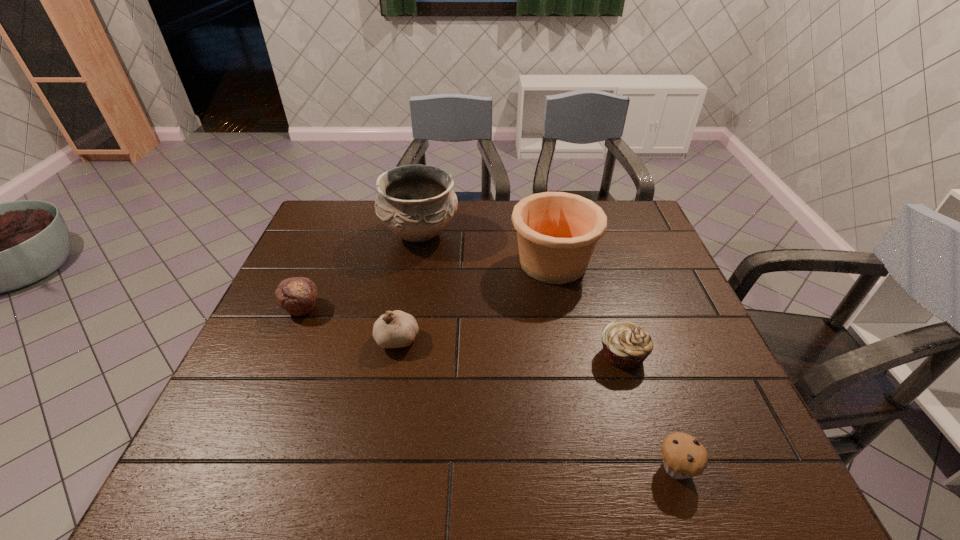
Locate an element on the screen. This screenshot has height=540, width=960. free point at the left edge is located at coordinates (297, 268).

Locate an element on the screen. The width and height of the screenshot is (960, 540). free location at the right edge of the desktop is located at coordinates point(614,244).

Where is `free space at the far right corner`? Image resolution: width=960 pixels, height=540 pixels. free space at the far right corner is located at coordinates (640, 218).

I want to click on free space between the leftmost muffin and the second nearest muffin, so click(x=462, y=332).

You are a GUI agent. You are given a task and a screenshot of the screen. Output one action in this format:
    pyautogui.click(x=<x>, y=<y>)
    Task: Click on the vacant region between the right pottery and the farthest muffin
    The width and height of the screenshot is (960, 540).
    Given the screenshot: What is the action you would take?
    pyautogui.click(x=427, y=286)

Identify the location of unoccupied position between the leftmost muffin and the right pottery. This screenshot has height=540, width=960. pyautogui.click(x=427, y=286).

The image size is (960, 540). Find the location of `empty space between the left pottery and the second farthest muffin`. empty space between the left pottery and the second farthest muffin is located at coordinates (521, 294).

Locate an element on the screen. free space between the garlic and the farthest muffin is located at coordinates tap(349, 323).

Where is `free space that is in between the leftmost muffin and the left pottery`? This screenshot has width=960, height=540. free space that is in between the leftmost muffin and the left pottery is located at coordinates (361, 271).

Locate an element on the screen. The width and height of the screenshot is (960, 540). free space between the garlic and the second nearest muffin is located at coordinates (510, 347).